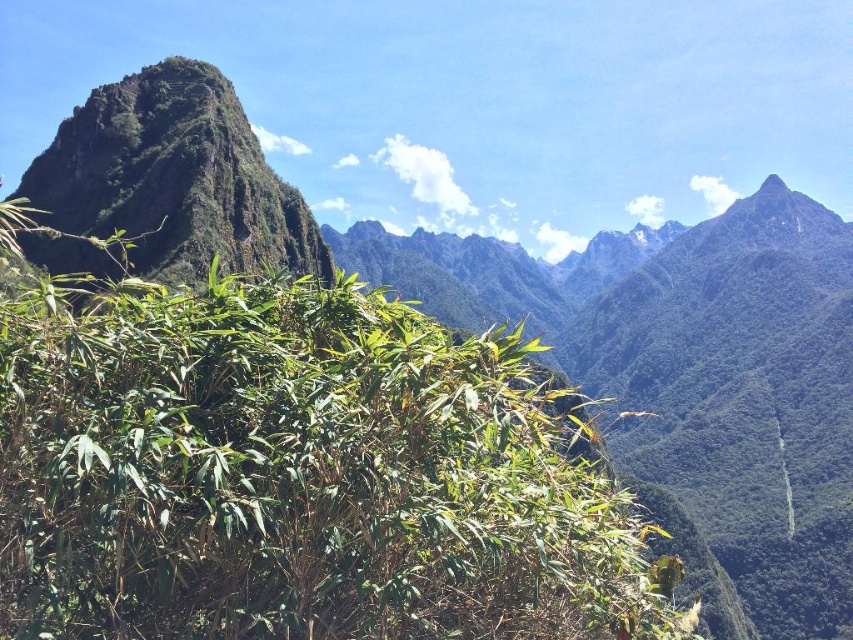
You are standing at the point marked by the coordinates point (299, 474) in the image. Looking around, what is the closest object to you?

The point (299, 474) corresponds to the green leafy plant at center, so the closest object to you is the green leafy plant at center.

You are an environmental scientist assessing the vegetation in this mountain area. You observe the green leafy plant at center and the green rough rock at upper left. Which object would cast a larger shadow given the same sunlight conditions?

The green leafy plant at center is larger in size than the green rough rock at upper left, so it would cast a larger shadow under the same sunlight conditions.

You are a hiker who wants to reach the green rough rock at upper left from your current position near the green leafy plant at center. Given that your average walking pace is 1.5 meters per second, how long will it take you to reach the rock if you walk directly towards it?

The distance between the green leafy plant at center and the green rough rock at upper left is 32.36 meters. At a walking pace of 1.5 meters per second, it will take approximately 21.57 seconds to reach the rock.